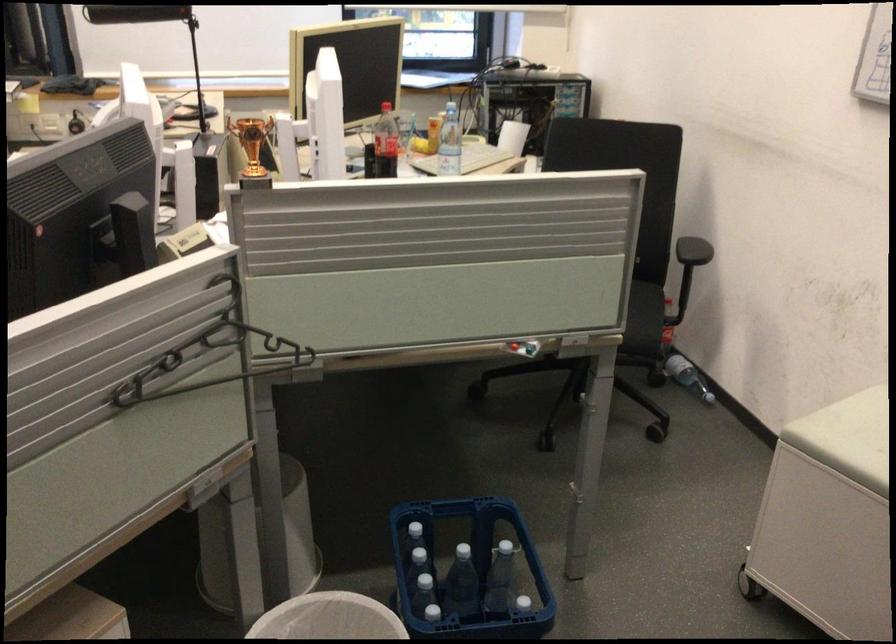
The width and height of the screenshot is (896, 644). What are the coordinates of `chair sitting surface` in the screenshot? It's located at pos(648,319).